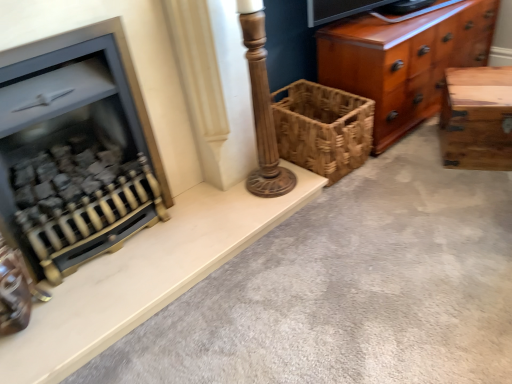
Identify the location of unoccupied region to the right of white marble fireplace at left. The height and width of the screenshot is (384, 512). (372, 243).